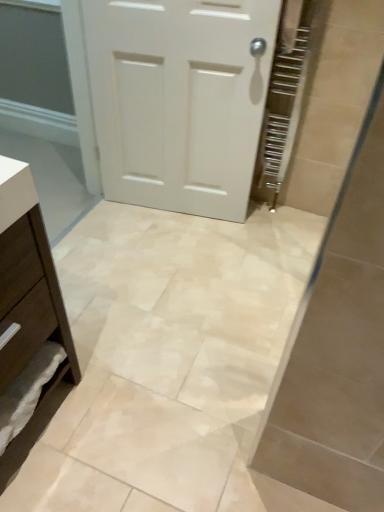
Question: Considering their positions, is white matte door at center located in front of or behind brown matte chest of drawers at lower left?

Choices:
 (A) behind
 (B) front

Answer: (A)

Question: Considering the positions of point (107, 121) and point (61, 323), is point (107, 121) closer or farther from the camera than point (61, 323)?

Choices:
 (A) closer
 (B) farther

Answer: (B)

Question: From the image's perspective, is white matte door at center located above or below brown matte chest of drawers at lower left?

Choices:
 (A) below
 (B) above

Answer: (B)

Question: From a real-world perspective, relative to white matte door at center, is brown matte chest of drawers at lower left vertically above or below?

Choices:
 (A) below
 (B) above

Answer: (A)

Question: Visually, is brown matte chest of drawers at lower left positioned to the left or to the right of white matte door at center?

Choices:
 (A) right
 (B) left

Answer: (B)

Question: Is brown matte chest of drawers at lower left situated inside white matte door at center or outside?

Choices:
 (A) outside
 (B) inside

Answer: (A)

Question: Is point (3, 487) positioned closer to the camera than point (218, 161)?

Choices:
 (A) closer
 (B) farther

Answer: (A)